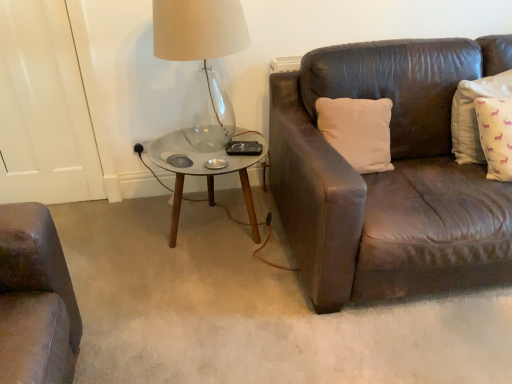
The image size is (512, 384). Describe the element at coordinates (358, 131) in the screenshot. I see `white matte pillow at upper right, arranged as the 1th pillow when viewed from the left` at that location.

Measure the distance between point (465, 93) and camera.

1.82 meters.

Find the location of a particular element. Image resolution: width=512 pixels, height=384 pixels. white matte pillow at upper right, arranged as the 1th pillow when viewed from the left is located at coordinates (358, 131).

From a real-world perspective, is metallic glass coffee table at center positioned above or below white matte pillow at upper right, which is the 2th pillow from right to left?

In terms of real-world spatial position, metallic glass coffee table at center is below white matte pillow at upper right, which is the 2th pillow from right to left.

Which of these two, metallic glass coffee table at center or white matte pillow at upper right, which is the 2th pillow from right to left, stands shorter?

white matte pillow at upper right, which is the 2th pillow from right to left, is shorter.

Does metallic glass coffee table at center turn towards white matte pillow at upper right, which is the 2th pillow from right to left?

No, metallic glass coffee table at center is not turned towards white matte pillow at upper right, which is the 2th pillow from right to left.

Which is more to the right, metallic glass coffee table at center or white matte pillow at upper right, which is the 2th pillow from right to left?

Positioned to the right is white matte pillow at upper right, which is the 2th pillow from right to left.

Between transparent glass table lamp at upper left and white matte pillow at upper right, which is the 2th pillow from right to left, which one has more height?

transparent glass table lamp at upper left.

Does transparent glass table lamp at upper left have a larger size compared to white matte pillow at upper right, which is the 2th pillow from right to left?

Correct, transparent glass table lamp at upper left is larger in size than white matte pillow at upper right, which is the 2th pillow from right to left.

From the image's perspective, is transparent glass table lamp at upper left located beneath white matte pillow at upper right, which is the 2th pillow from right to left?

No.

From a real-world perspective, is metallic glass coffee table at center physically below yellow cotton pillow at right, which ranks as the second pillow in left-to-right order?

Yes, from a real-world perspective, metallic glass coffee table at center is beneath yellow cotton pillow at right, which ranks as the second pillow in left-to-right order.

From the image's perspective, count 1st pillows upward from the metallic glass coffee table at center and point to it. Please provide its 2D coordinates.

[(474, 114)]

How different are the orientations of metallic glass coffee table at center and yellow cotton pillow at right, which ranks as the second pillow in left-to-right order, in degrees?

metallic glass coffee table at center and yellow cotton pillow at right, which ranks as the second pillow in left-to-right order, are facing 20.6 degrees away from each other.

Is metallic glass coffee table at center inside the boundaries of yellow cotton pillow at right, placed as the 1th pillow when sorted from right to left, or outside?

metallic glass coffee table at center cannot be found inside yellow cotton pillow at right, placed as the 1th pillow when sorted from right to left.

Is transparent glass table lamp at upper left touching yellow cotton pillow at right, placed as the 1th pillow when sorted from right to left?

No.

From the image's perspective, is transparent glass table lamp at upper left below yellow cotton pillow at right, which ranks as the second pillow in left-to-right order?

No, from the image's perspective, transparent glass table lamp at upper left is not beneath yellow cotton pillow at right, which ranks as the second pillow in left-to-right order.

Is yellow cotton pillow at right, placed as the 1th pillow when sorted from right to left, inside the boundaries of metallic glass coffee table at center, or outside?

yellow cotton pillow at right, placed as the 1th pillow when sorted from right to left, is outside metallic glass coffee table at center.

Considering the sizes of objects yellow cotton pillow at right, which ranks as the second pillow in left-to-right order, and metallic glass coffee table at center in the image provided, who is wider, yellow cotton pillow at right, which ranks as the second pillow in left-to-right order, or metallic glass coffee table at center?

metallic glass coffee table at center.

Based on the photo, does yellow cotton pillow at right, placed as the 1th pillow when sorted from right to left, appear on the right side of metallic glass coffee table at center?

Correct, you'll find yellow cotton pillow at right, placed as the 1th pillow when sorted from right to left, to the right of metallic glass coffee table at center.

Consider the image. Is yellow cotton pillow at right, which ranks as the second pillow in left-to-right order, taller than metallic glass coffee table at center?

Yes, yellow cotton pillow at right, which ranks as the second pillow in left-to-right order, is taller than metallic glass coffee table at center.

The height and width of the screenshot is (384, 512). In order to click on table lamp that appears above the white matte pillow at upper right, which is the 2th pillow from right to left (from the image's perspective) in this screenshot , I will do `click(203, 61)`.

Between white matte pillow at upper right, which is the 2th pillow from right to left, and transparent glass table lamp at upper left, which one has smaller size?

Smaller between the two is white matte pillow at upper right, which is the 2th pillow from right to left.

Considering their positions, is white matte pillow at upper right, which is the 2th pillow from right to left, located in front of or behind transparent glass table lamp at upper left?

white matte pillow at upper right, which is the 2th pillow from right to left, is behind transparent glass table lamp at upper left.

Between point (376, 171) and point (231, 122), which one is positioned behind?

The point (231, 122) is farther from the camera.

Is metallic glass coffee table at center a part of white matte pillow at upper right, arranged as the 1th pillow when viewed from the left?

No, metallic glass coffee table at center is not inside white matte pillow at upper right, arranged as the 1th pillow when viewed from the left.

Between white matte pillow at upper right, arranged as the 1th pillow when viewed from the left, and metallic glass coffee table at center, which one appears on the left side from the viewer's perspective?

metallic glass coffee table at center.

Is white matte pillow at upper right, arranged as the 1th pillow when viewed from the left, looking in the opposite direction of metallic glass coffee table at center?

No, white matte pillow at upper right, arranged as the 1th pillow when viewed from the left,'s orientation is not away from metallic glass coffee table at center.

From a real-world perspective, is white matte pillow at upper right, which is the 2th pillow from right to left, positioned above or below metallic glass coffee table at center?

From a real-world perspective, white matte pillow at upper right, which is the 2th pillow from right to left, is physically above metallic glass coffee table at center.

Identify the location of coffee table on the left side of white matte pillow at upper right, arranged as the 1th pillow when viewed from the left. (207, 172).

There is a transparent glass table lamp at upper left. At what (x,y) coordinates should I click in order to perform the action: click on the 1st pillow below it (from the image's perspective). Please return your answer as a coordinate pair (x, y). The height and width of the screenshot is (384, 512). Looking at the image, I should click on (358, 131).

Estimate the real-world distances between objects in this image. Which object is further from metallic glass coffee table at center, white matte pillow at upper right, arranged as the 1th pillow when viewed from the left, or yellow cotton pillow at right, which ranks as the second pillow in left-to-right order?

The object further to metallic glass coffee table at center is yellow cotton pillow at right, which ranks as the second pillow in left-to-right order.

In the scene shown: Which object lies nearer to the anchor point metallic glass coffee table at center, white matte pillow at upper right, arranged as the 1th pillow when viewed from the left, or transparent glass table lamp at upper left?

Among the two, transparent glass table lamp at upper left is located nearer to metallic glass coffee table at center.

Based on their spatial positions, is yellow cotton pillow at right, placed as the 1th pillow when sorted from right to left, or transparent glass table lamp at upper left further from white matte pillow at upper right, which is the 2th pillow from right to left?

transparent glass table lamp at upper left is further to white matte pillow at upper right, which is the 2th pillow from right to left.

Which object lies nearer to the anchor point yellow cotton pillow at right, which ranks as the second pillow in left-to-right order, transparent glass table lamp at upper left or metallic glass coffee table at center?

Based on the image, metallic glass coffee table at center appears to be nearer to yellow cotton pillow at right, which ranks as the second pillow in left-to-right order.

From the image, which object appears to be nearer to metallic glass coffee table at center, transparent glass table lamp at upper left or white matte pillow at upper right, which is the 2th pillow from right to left?

transparent glass table lamp at upper left is positioned closer to the anchor metallic glass coffee table at center.

Looking at the image, which one is located further to metallic glass coffee table at center, yellow cotton pillow at right, which ranks as the second pillow in left-to-right order, or white matte pillow at upper right, arranged as the 1th pillow when viewed from the left?

yellow cotton pillow at right, which ranks as the second pillow in left-to-right order, is positioned further to the anchor metallic glass coffee table at center.

Estimate the real-world distances between objects in this image. Which object is further from yellow cotton pillow at right, which ranks as the second pillow in left-to-right order, metallic glass coffee table at center or transparent glass table lamp at upper left?

Based on the image, transparent glass table lamp at upper left appears to be further to yellow cotton pillow at right, which ranks as the second pillow in left-to-right order.

Looking at the image, which one is located further to transparent glass table lamp at upper left, metallic glass coffee table at center or yellow cotton pillow at right, which ranks as the second pillow in left-to-right order?

yellow cotton pillow at right, which ranks as the second pillow in left-to-right order.

In order to click on coffee table between transparent glass table lamp at upper left and yellow cotton pillow at right, which ranks as the second pillow in left-to-right order, from left to right in this screenshot , I will do `click(207, 172)`.

What are the coordinates of `pillow between transparent glass table lamp at upper left and yellow cotton pillow at right, placed as the 1th pillow when sorted from right to left, from left to right` in the screenshot? It's located at (358, 131).

At what (x,y) coordinates should I click in order to perform the action: click on coffee table between transparent glass table lamp at upper left and white matte pillow at upper right, arranged as the 1th pillow when viewed from the left, from left to right. Please return your answer as a coordinate pair (x, y). The image size is (512, 384). Looking at the image, I should click on [x=207, y=172].

Where is `pillow between metallic glass coffee table at center and yellow cotton pillow at right, which ranks as the second pillow in left-to-right order`? Image resolution: width=512 pixels, height=384 pixels. pillow between metallic glass coffee table at center and yellow cotton pillow at right, which ranks as the second pillow in left-to-right order is located at coordinates (358, 131).